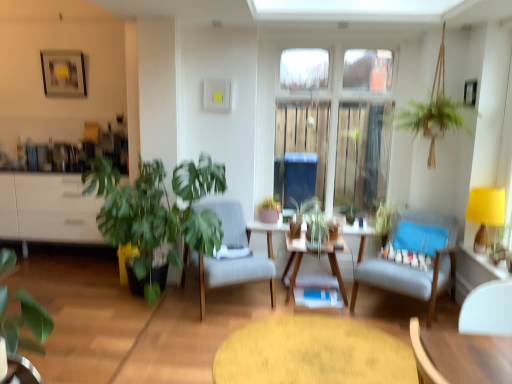
Identify the location of free space underneath wooden round table at center (from a real-world perspective). (303, 358).